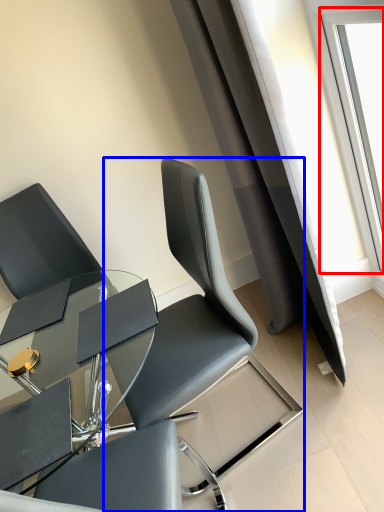
Question: Which object appears farthest to the camera in this image, window (highlighted by a red box) or chair (highlighted by a blue box)?

Choices:
 (A) window
 (B) chair

Answer: (A)